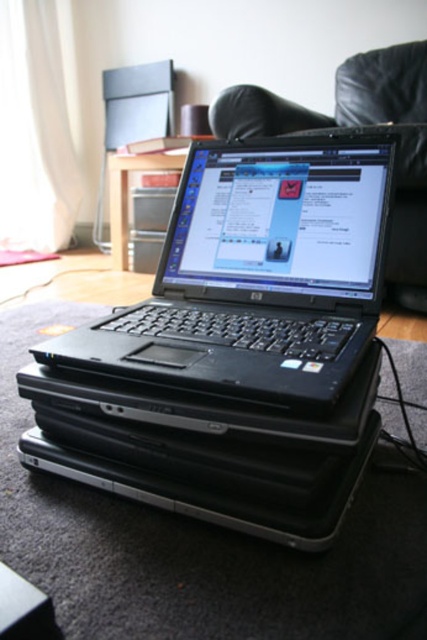
Between point (222, 104) and point (35, 461), which one is positioned behind?

Point (222, 104)

Between point (398, 301) and point (70, 460), which one is positioned behind?

Point (398, 301)

Where is `black leather couch at upper center`? Image resolution: width=427 pixels, height=640 pixels. black leather couch at upper center is located at coordinates (359, 129).

Who is taller, black matte laptop at center or black plastic laptop at center?

With more height is black matte laptop at center.

Who is higher up, black matte laptop at center or black plastic laptop at center?

black matte laptop at center is above.

This screenshot has height=640, width=427. In order to click on black matte laptop at center in this screenshot , I will do pos(257,275).

At what (x,y) coordinates should I click in order to perform the action: click on black matte laptop at center. Please return your answer as a coordinate pair (x, y). Looking at the image, I should click on (257, 275).

Is point (297, 148) positioned before point (385, 282)?

No, (297, 148) is further to viewer.

Does black matte laptop at center appear over black leather couch at upper center?

No.

Image resolution: width=427 pixels, height=640 pixels. What are the coordinates of `black matte laptop at center` in the screenshot? It's located at pyautogui.click(x=257, y=275).